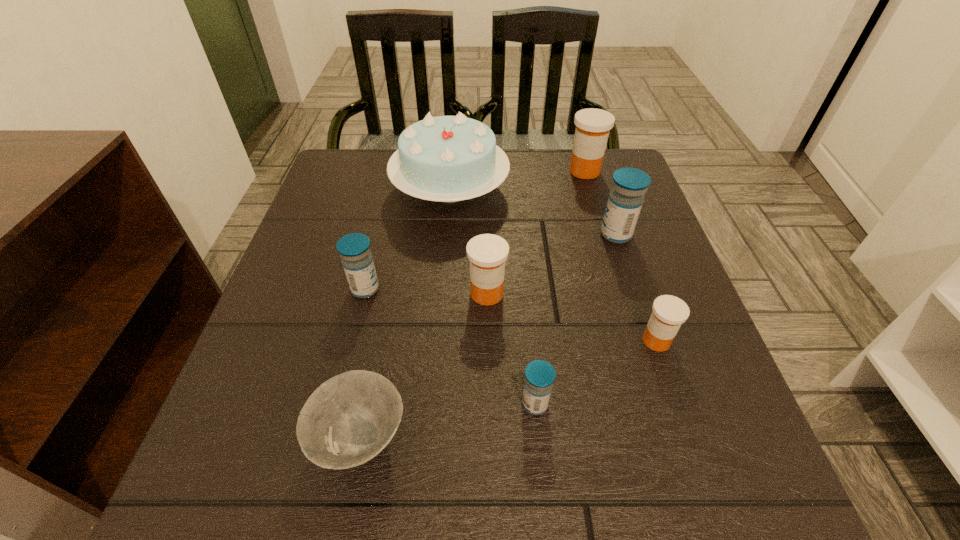
Image resolution: width=960 pixels, height=540 pixels. In order to click on birthday cake in this screenshot , I will do `click(447, 158)`.

The width and height of the screenshot is (960, 540). In order to click on the tallest object in this screenshot , I will do `click(447, 158)`.

Identify the location of the biggest orange medicine. This screenshot has height=540, width=960. 593,125.

Identify the location of the farthest orange medicine. (593, 125).

In order to click on the biggest blue medicine in this screenshot , I will do `click(626, 198)`.

I want to click on the farthest blue medicine, so click(626, 198).

Locate an element on the screen. the second nearest blue medicine is located at coordinates click(x=354, y=249).

You are a GUI agent. You are given a task and a screenshot of the screen. Output one action in this format:
    pyautogui.click(x=<x>, y=<y>)
    Task: Click on the leftmost blue medicine
    The image size is (960, 540).
    Given the screenshot: What is the action you would take?
    pyautogui.click(x=354, y=249)

The image size is (960, 540). In order to click on the leftmost orange medicine in this screenshot , I will do `click(487, 253)`.

Where is `the second smallest orange medicine`? The width and height of the screenshot is (960, 540). the second smallest orange medicine is located at coordinates (487, 253).